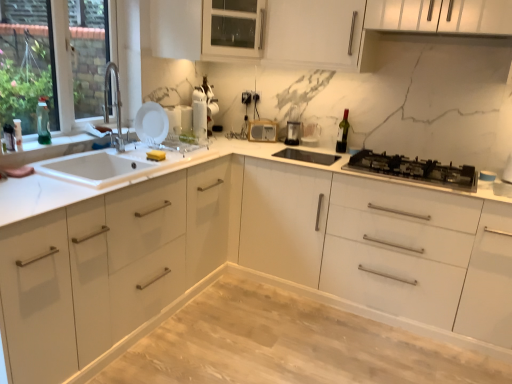
Question: Is light wood/dark stain dining table at center at the right side of green glass wine bottle at upper right?

Choices:
 (A) no
 (B) yes

Answer: (A)

Question: From the image's perspective, is light wood/dark stain dining table at center located beneath green glass wine bottle at upper right?

Choices:
 (A) yes
 (B) no

Answer: (A)

Question: Is light wood/dark stain dining table at center oriented towards green glass wine bottle at upper right?

Choices:
 (A) yes
 (B) no

Answer: (B)

Question: From the image's perspective, is light wood/dark stain dining table at center located above green glass wine bottle at upper right?

Choices:
 (A) no
 (B) yes

Answer: (A)

Question: Can you confirm if light wood/dark stain dining table at center is thinner than green glass wine bottle at upper right?

Choices:
 (A) yes
 (B) no

Answer: (B)

Question: In the image, is white glossy cabinet at upper center, placed as the second cabinetry when sorted from bottom to top, positioned in front of or behind white matte plate at upper left, the 1th appliance from the front?

Choices:
 (A) behind
 (B) front

Answer: (B)

Question: From a real-world perspective, is white glossy cabinet at upper center, positioned as the first cabinetry in top-to-bottom order, positioned above or below white matte plate at upper left, marked as the first appliance in a left-to-right arrangement?

Choices:
 (A) below
 (B) above

Answer: (B)

Question: Considering the positions of white glossy cabinet at upper center, placed as the second cabinetry when sorted from bottom to top, and white matte plate at upper left, the 4th appliance positioned from the right, in the image, is white glossy cabinet at upper center, placed as the second cabinetry when sorted from bottom to top, taller or shorter than white matte plate at upper left, the 4th appliance positioned from the right,?

Choices:
 (A) short
 (B) tall

Answer: (B)

Question: Looking at their shapes, would you say white glossy cabinet at upper center, placed as the second cabinetry when sorted from bottom to top, is wider or thinner than white matte plate at upper left, the 1th appliance from the front?

Choices:
 (A) thin
 (B) wide

Answer: (B)

Question: In the image, is green glass bottle at left, which ranks as the first bottle in back-to-front order, positioned in front of or behind black plastic coffee maker at center, which is counted as the 3th appliance, starting from the front?

Choices:
 (A) behind
 (B) front

Answer: (B)

Question: Visually, is green glass bottle at left, arranged as the 2th bottle when viewed from the left, positioned to the left or to the right of black plastic coffee maker at center, which is counted as the 3th appliance, starting from the front?

Choices:
 (A) left
 (B) right

Answer: (A)

Question: Considering the positions of green glass bottle at left, the 2th bottle from the front, and black plastic coffee maker at center, which appears as the 4th appliance when viewed from the left, in the image, is green glass bottle at left, the 2th bottle from the front, wider or thinner than black plastic coffee maker at center, which appears as the 4th appliance when viewed from the left,?

Choices:
 (A) wide
 (B) thin

Answer: (B)

Question: Do you think green glass bottle at left, the 2th bottle from the front, is within black plastic coffee maker at center, the first appliance when ordered from right to left, or outside of it?

Choices:
 (A) outside
 (B) inside

Answer: (A)

Question: Does point (126, 193) appear closer or farther from the camera than point (336, 145)?

Choices:
 (A) closer
 (B) farther

Answer: (A)

Question: From the image's perspective, is white glossy cabinet at center, marked as the first cabinetry in a bottom-to-top arrangement, above or below green glass wine bottle at upper right?

Choices:
 (A) below
 (B) above

Answer: (A)